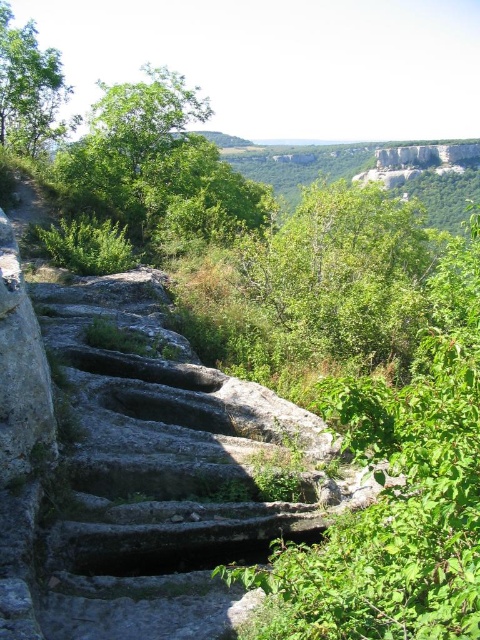
Question: Does green leafy tree at center have a greater width compared to green leafy tree at upper left?

Choices:
 (A) no
 (B) yes

Answer: (B)

Question: Which of the following is the farthest from the observer?

Choices:
 (A) click(x=124, y=96)
 (B) click(x=384, y=352)
 (C) click(x=23, y=36)

Answer: (A)

Question: Among these objects, which one is nearest to the camera?

Choices:
 (A) green leafy tree at upper center
 (B) green leafy tree at upper left

Answer: (A)

Question: Which of the following is the closest to the observer?

Choices:
 (A) coord(55,177)
 (B) coord(294,314)
 (C) coord(50,49)

Answer: (B)

Question: Is green leafy tree at center thinner than green leafy tree at upper left?

Choices:
 (A) yes
 (B) no

Answer: (B)

Question: Does green leafy tree at center have a lesser width compared to green leafy tree at upper center?

Choices:
 (A) no
 (B) yes

Answer: (B)